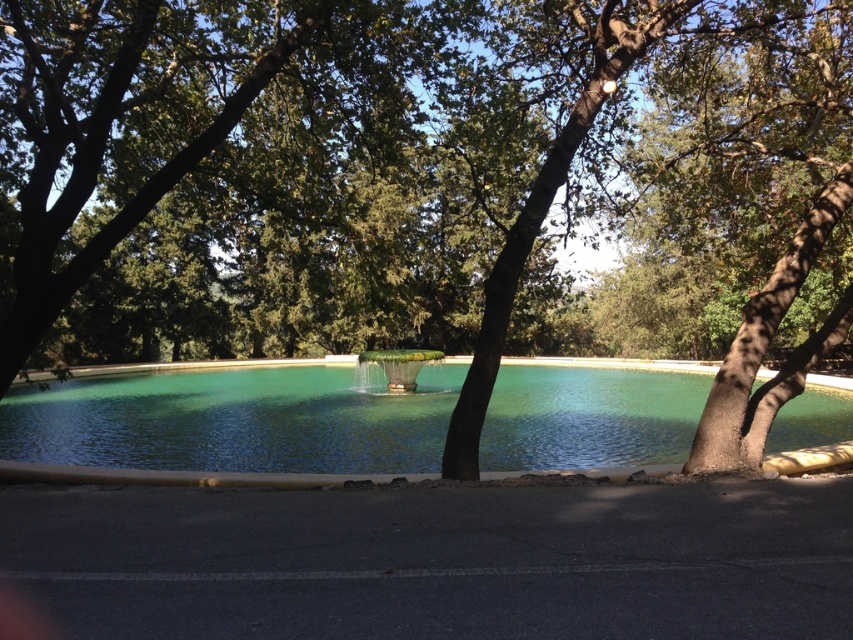
Which is in front, point (529, 268) or point (587, 403)?

Point (529, 268) is more forward.

Is point (312, 160) behind point (67, 458)?

No, (312, 160) is in front of (67, 458).

You are a GUI agent. You are given a task and a screenshot of the screen. Output one action in this format:
    pyautogui.click(x=<x>, y=<y>)
    Task: Click on the green leafy tree at center
    The width and height of the screenshot is (853, 640).
    Given the screenshot: What is the action you would take?
    pyautogui.click(x=532, y=193)

Who is positioned more to the right, green leafy tree at center or green marble fountain at center?

green leafy tree at center

Is green leafy tree at center to the right of green marble fountain at center from the viewer's perspective?

Yes, green leafy tree at center is to the right of green marble fountain at center.

Who is more distant from viewer, (671, 221) or (408, 378)?

The point (408, 378) is behind.

You are a GUI agent. You are given a task and a screenshot of the screen. Output one action in this format:
    pyautogui.click(x=<x>, y=<y>)
    Task: Click on the green leafy tree at center
    The image size is (853, 640).
    Given the screenshot: What is the action you would take?
    pyautogui.click(x=532, y=193)

Can you confirm if green glassy lake at center is smaller than green marble fountain at center?

Incorrect, green glassy lake at center is not smaller in size than green marble fountain at center.

Who is positioned more to the left, green glassy lake at center or green marble fountain at center?

From the viewer's perspective, green glassy lake at center appears more on the left side.

What do you see at coordinates (235, 420) in the screenshot?
I see `green glassy lake at center` at bounding box center [235, 420].

The image size is (853, 640). In order to click on green glassy lake at center in this screenshot , I will do `click(235, 420)`.